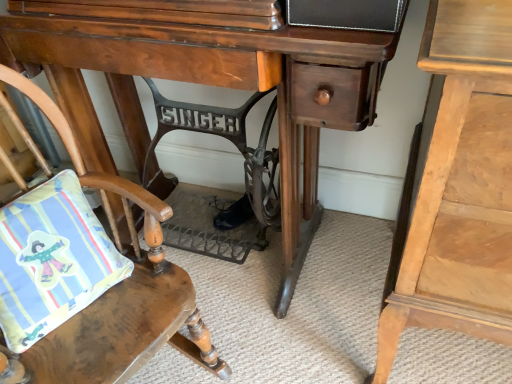
Locate an element on the screen. The image size is (512, 384). vacant area situated below wooden desk at center (from a real-world perspective) is located at coordinates (244, 242).